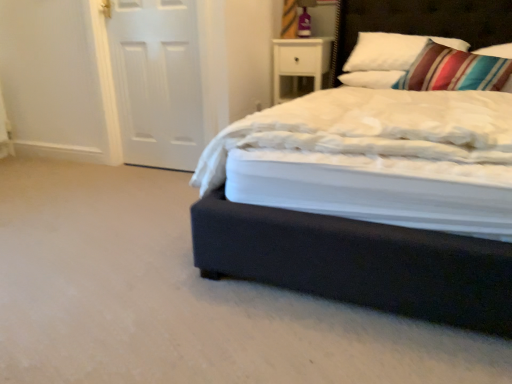
Question: Can you confirm if white soft pillow at upper right, the first pillow positioned from the left, is positioned to the right of striped fabric pillow at upper right, which ranks as the second pillow in left-to-right order?

Choices:
 (A) yes
 (B) no

Answer: (B)

Question: Would you say striped fabric pillow at upper right, which appears as the 1th pillow when viewed from the right, is part of white soft pillow at upper right, marked as the second pillow in a right-to-left arrangement,'s contents?

Choices:
 (A) no
 (B) yes

Answer: (A)

Question: Does white soft pillow at upper right, the first pillow positioned from the left, have a larger size compared to striped fabric pillow at upper right, which ranks as the second pillow in left-to-right order?

Choices:
 (A) yes
 (B) no

Answer: (A)

Question: Does white soft pillow at upper right, marked as the second pillow in a right-to-left arrangement, lie in front of striped fabric pillow at upper right, which ranks as the second pillow in left-to-right order?

Choices:
 (A) no
 (B) yes

Answer: (A)

Question: Can you confirm if white soft pillow at upper right, marked as the second pillow in a right-to-left arrangement, is taller than striped fabric pillow at upper right, which appears as the 1th pillow when viewed from the right?

Choices:
 (A) yes
 (B) no

Answer: (B)

Question: Is white soft pillow at upper right, marked as the second pillow in a right-to-left arrangement, to the left of striped fabric pillow at upper right, which ranks as the second pillow in left-to-right order, from the viewer's perspective?

Choices:
 (A) yes
 (B) no

Answer: (A)

Question: Is white matte door at left to the left of dark blue fabric bed at center from the viewer's perspective?

Choices:
 (A) no
 (B) yes

Answer: (B)

Question: Considering the relative sizes of white matte door at left and dark blue fabric bed at center in the image provided, is white matte door at left bigger than dark blue fabric bed at center?

Choices:
 (A) yes
 (B) no

Answer: (B)

Question: Considering the relative sizes of white matte door at left and dark blue fabric bed at center in the image provided, is white matte door at left taller than dark blue fabric bed at center?

Choices:
 (A) no
 (B) yes

Answer: (A)

Question: Is white matte door at left next to dark blue fabric bed at center and touching it?

Choices:
 (A) no
 (B) yes

Answer: (A)

Question: Is white matte door at left facing away from dark blue fabric bed at center?

Choices:
 (A) no
 (B) yes

Answer: (A)

Question: From the image's perspective, is white matte door at left under dark blue fabric bed at center?

Choices:
 (A) yes
 (B) no

Answer: (B)

Question: Is white soft pillow at upper right, the first pillow positioned from the left, aimed at dark wood headboard at upper right?

Choices:
 (A) yes
 (B) no

Answer: (A)